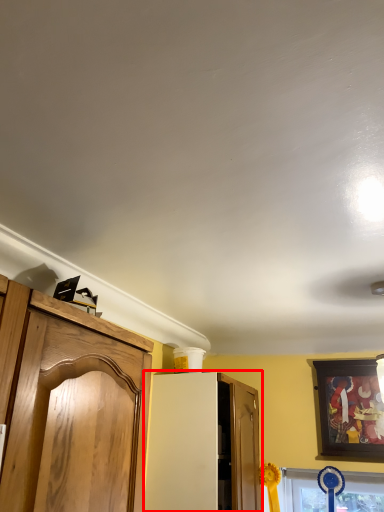
Question: Where is cabinetry (annotated by the red box) located in relation to picture frame in the image?

Choices:
 (A) right
 (B) left

Answer: (B)